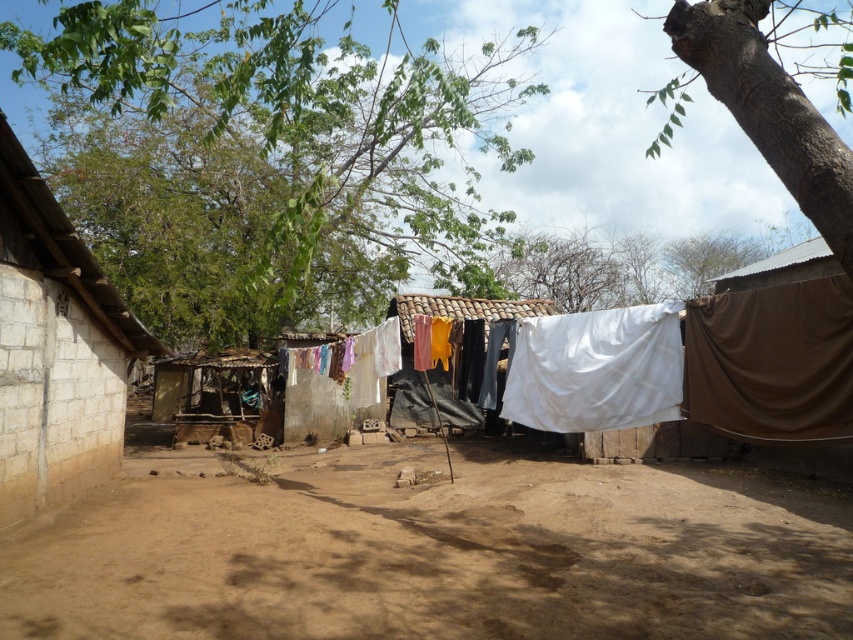
Can you confirm if green leafy tree at upper center is smaller than brown rough bark tree at upper right?

No.

Between point (155, 102) and point (708, 76), which one is positioned in front?

Point (708, 76) is in front.

The height and width of the screenshot is (640, 853). What do you see at coordinates (265, 160) in the screenshot?
I see `green leafy tree at upper center` at bounding box center [265, 160].

You are a GUI agent. You are given a task and a screenshot of the screen. Output one action in this format:
    pyautogui.click(x=<x>, y=<y>)
    Task: Click on the green leafy tree at upper center
    
    Given the screenshot: What is the action you would take?
    pos(265,160)

Does light beige concrete hut at left appear over brown rough bark tree at upper right?

No, light beige concrete hut at left is not above brown rough bark tree at upper right.

Looking at this image, does light beige concrete hut at left come behind brown rough bark tree at upper right?

Yes, light beige concrete hut at left is further from the viewer.

You are a GUI agent. You are given a task and a screenshot of the screen. Output one action in this format:
    pyautogui.click(x=<x>, y=<y>)
    Task: Click on the light beige concrete hut at left
    The height and width of the screenshot is (640, 853).
    Given the screenshot: What is the action you would take?
    pyautogui.click(x=55, y=348)

Locate an element on the screen. The image size is (853, 640). light beige concrete hut at left is located at coordinates (55, 348).

From the picture: How far apart are brown dirt field at center and green leafy tree at upper center?

28.54 feet

Between point (816, 570) and point (328, 269), which one is positioned in front?

Point (816, 570) is in front.

Locate an element on the screen. This screenshot has height=640, width=853. brown dirt field at center is located at coordinates (438, 554).